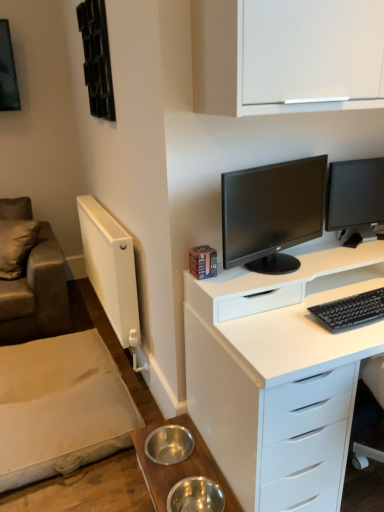
Question: Can you confirm if matte black monitor at center, which is the second computer monitor from right to left, is bigger than white matte cabinet at upper center?

Choices:
 (A) yes
 (B) no

Answer: (B)

Question: Could you tell me if matte black monitor at center, which is the second computer monitor from right to left, is turned towards white matte cabinet at upper center?

Choices:
 (A) no
 (B) yes

Answer: (A)

Question: Considering the relative sizes of matte black monitor at center, which is the second computer monitor from right to left, and white matte cabinet at upper center in the image provided, is matte black monitor at center, which is the second computer monitor from right to left, thinner than white matte cabinet at upper center?

Choices:
 (A) no
 (B) yes

Answer: (B)

Question: Is matte black monitor at center, the 1th computer monitor positioned from the left, smaller than white matte cabinet at upper center?

Choices:
 (A) yes
 (B) no

Answer: (A)

Question: Is matte black monitor at center, which is the second computer monitor from right to left, wider than white matte cabinet at upper center?

Choices:
 (A) no
 (B) yes

Answer: (A)

Question: Visually, is metallic stainless steel bowls at lower center positioned to the left or to the right of white matte cabinet at upper center?

Choices:
 (A) right
 (B) left

Answer: (B)

Question: Looking at their shapes, would you say metallic stainless steel bowls at lower center is wider or thinner than white matte cabinet at upper center?

Choices:
 (A) thin
 (B) wide

Answer: (A)

Question: In terms of size, does metallic stainless steel bowls at lower center appear bigger or smaller than white matte cabinet at upper center?

Choices:
 (A) small
 (B) big

Answer: (A)

Question: Is point (173, 478) closer or farther from the camera than point (354, 61)?

Choices:
 (A) farther
 (B) closer

Answer: (A)

Question: Does point (31, 209) appear closer or farther from the camera than point (339, 216)?

Choices:
 (A) closer
 (B) farther

Answer: (B)

Question: Is leather-like brown couch at left to the left or to the right of black glossy monitor at right, the second computer monitor when ordered from left to right, in the image?

Choices:
 (A) right
 (B) left

Answer: (B)

Question: Looking at the image, does leather-like brown couch at left seem bigger or smaller compared to black glossy monitor at right, arranged as the first computer monitor when viewed from the right?

Choices:
 (A) small
 (B) big

Answer: (B)

Question: From a real-world perspective, is leather-like brown couch at left physically located above or below black glossy monitor at right, the second computer monitor when ordered from left to right?

Choices:
 (A) below
 (B) above

Answer: (A)

Question: From the image's perspective, relative to black glossy monitor at right, the second computer monitor when ordered from left to right, is white glossy desk at center above or below?

Choices:
 (A) below
 (B) above

Answer: (A)

Question: In the image, is white glossy desk at center positioned in front of or behind black glossy monitor at right, arranged as the first computer monitor when viewed from the right?

Choices:
 (A) behind
 (B) front

Answer: (B)